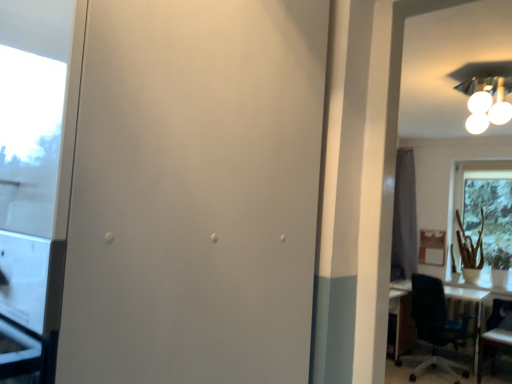
Question: In the image, is green matte plant at right positioned in front of or behind gray fabric curtain at right?

Choices:
 (A) behind
 (B) front

Answer: (B)

Question: Visually, is green matte plant at right positioned to the left or to the right of gray fabric curtain at right?

Choices:
 (A) left
 (B) right

Answer: (B)

Question: Estimate the real-world distances between objects in this image. Which object is closer to the wooden chair at right, arranged as the second chair when viewed from the left?

Choices:
 (A) black plastic chair at right, the second chair when ordered from right to left
 (B) white glossy light fixture at upper right
 (C) gray fabric curtain at right
 (D) transparent glass window at right
 (E) green matte plant at right

Answer: (A)

Question: Estimate the real-world distances between objects in this image. Which object is closer to the white matte screen door at center?

Choices:
 (A) green matte plant at right
 (B) wooden chair at right, arranged as the second chair when viewed from the left
 (C) transparent glass window at right
 (D) white glossy light fixture at upper right
 (E) black plastic chair at right, the first chair when ordered from left to right

Answer: (D)